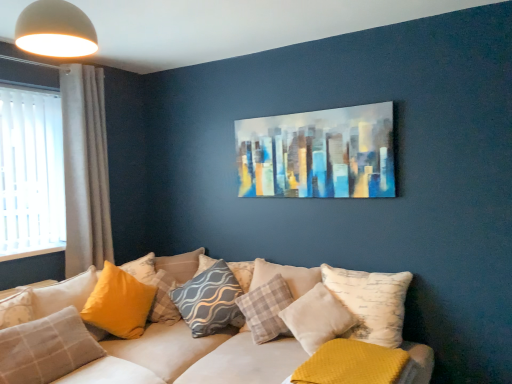
Question: Is gray textured pillow at center, the 4th pillow from the right, a part of plaid fabric pillow at center, which ranks as the seventh pillow in left-to-right order?

Choices:
 (A) no
 (B) yes

Answer: (A)

Question: Considering the relative positions of plaid fabric pillow at center, which ranks as the 3th pillow in right-to-left order, and gray textured pillow at center, the 4th pillow from the right, in the image provided, is plaid fabric pillow at center, which ranks as the 3th pillow in right-to-left order, to the right of gray textured pillow at center, the 4th pillow from the right, from the viewer's perspective?

Choices:
 (A) yes
 (B) no

Answer: (A)

Question: Does plaid fabric pillow at center, which ranks as the 3th pillow in right-to-left order, have a lesser width compared to gray textured pillow at center, the sixth pillow in the left-to-right sequence?

Choices:
 (A) no
 (B) yes

Answer: (A)

Question: Can you confirm if plaid fabric pillow at center, which ranks as the 3th pillow in right-to-left order, is positioned to the left of gray textured pillow at center, the 4th pillow from the right?

Choices:
 (A) no
 (B) yes

Answer: (A)

Question: Can you confirm if plaid fabric pillow at center, which ranks as the 3th pillow in right-to-left order, is smaller than gray textured pillow at center, the 4th pillow from the right?

Choices:
 (A) yes
 (B) no

Answer: (B)

Question: Can you confirm if plaid fabric pillow at center, which ranks as the seventh pillow in left-to-right order, is wider than gray textured pillow at center, the 4th pillow from the right?

Choices:
 (A) no
 (B) yes

Answer: (B)

Question: Are gray fabric curtain at left and mustard yellow textured pillow at lower right, which ranks as the 1th pillow in right-to-left order, beside each other?

Choices:
 (A) no
 (B) yes

Answer: (A)

Question: Can you confirm if gray fabric curtain at left is taller than mustard yellow textured pillow at lower right, which is the 9th pillow from left to right?

Choices:
 (A) no
 (B) yes

Answer: (B)

Question: Is mustard yellow textured pillow at lower right, which ranks as the 1th pillow in right-to-left order, inside gray fabric curtain at left?

Choices:
 (A) no
 (B) yes

Answer: (A)

Question: Is gray fabric curtain at left closer to camera compared to mustard yellow textured pillow at lower right, which is the 9th pillow from left to right?

Choices:
 (A) yes
 (B) no

Answer: (B)

Question: Could you tell me if gray fabric curtain at left is turned towards mustard yellow textured pillow at lower right, which ranks as the 1th pillow in right-to-left order?

Choices:
 (A) yes
 (B) no

Answer: (A)

Question: Is gray fabric curtain at left turned away from mustard yellow textured pillow at lower right, which is the 9th pillow from left to right?

Choices:
 (A) no
 (B) yes

Answer: (A)

Question: From the image's perspective, is gray textured pillow at center, the sixth pillow in the left-to-right sequence, located above mustard yellow textured pillow at lower right, which ranks as the 1th pillow in right-to-left order?

Choices:
 (A) no
 (B) yes

Answer: (B)